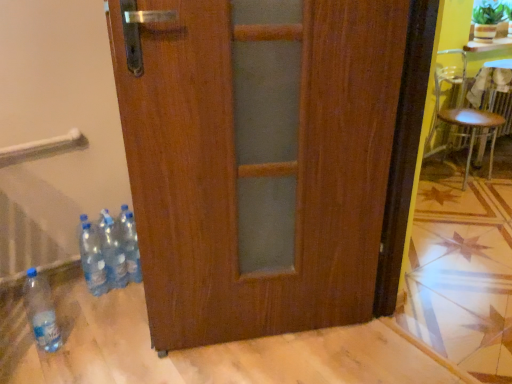
Image resolution: width=512 pixels, height=384 pixels. What are the coordinates of `free space that is in between transparent plastic bottle at lower left, which is the 1th bottle from left to right, and blue plastic bottle at lower left, which is the 4th bottle from left to right` in the screenshot? It's located at (92, 312).